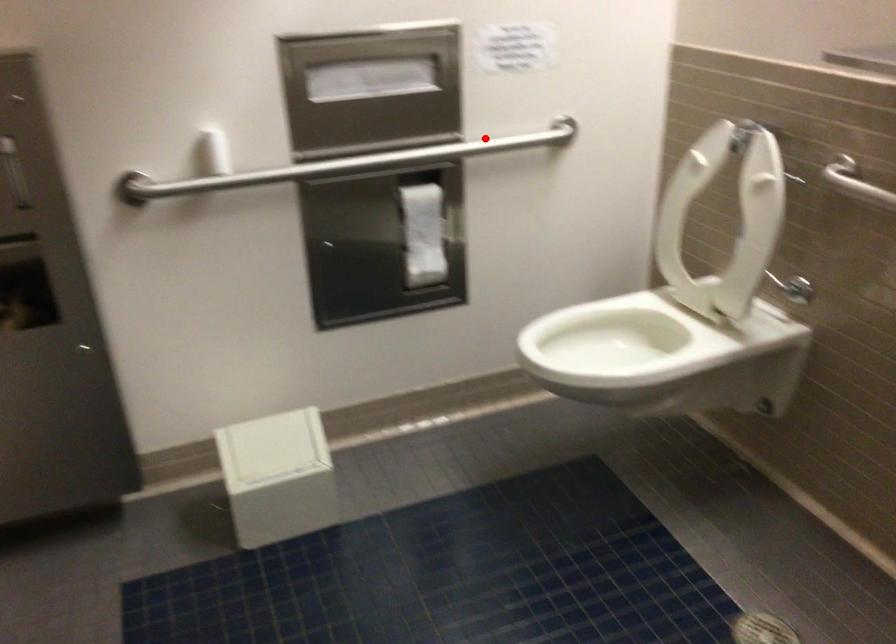
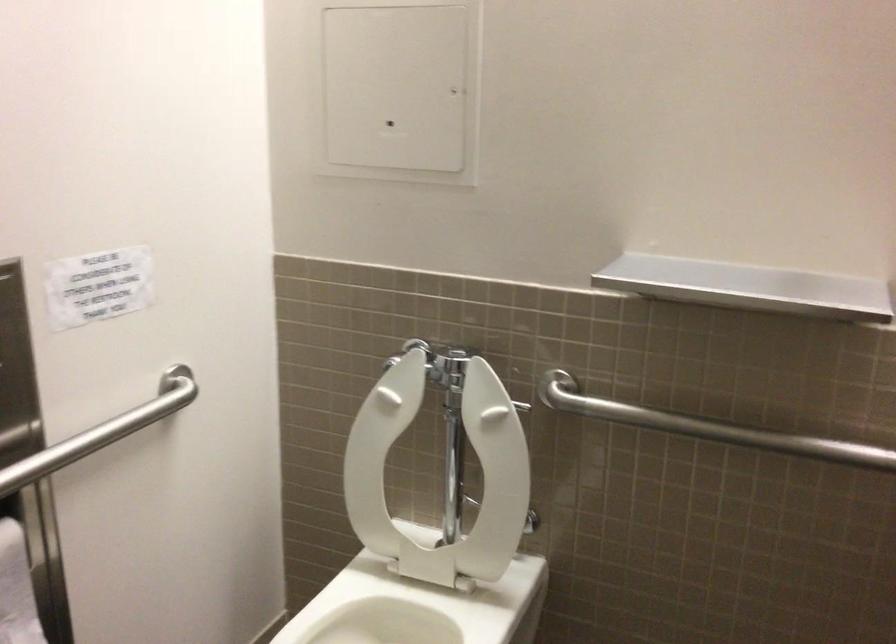
Question: I am providing you with two images of the same scene from different viewpoints. Given a red point in image1, look at the same physical point in image2. Is it:

Choices:
 (A) Closer to the viewpoint
 (B) Farther from the viewpoint

Answer: (A)